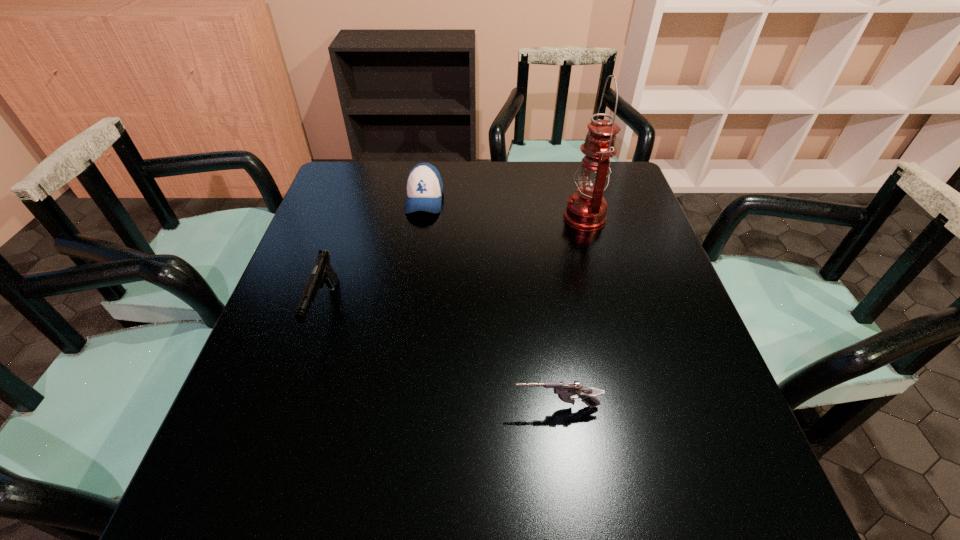
At what (x,y) coordinates should I click in order to perform the action: click on oil lamp. Please return your answer as a coordinate pair (x, y). This screenshot has width=960, height=540. Looking at the image, I should click on (586, 209).

Where is `the rightmost object`? The height and width of the screenshot is (540, 960). the rightmost object is located at coordinates (586, 209).

Find the location of a particular element. Image resolution: width=960 pixels, height=540 pixels. the second nearest object is located at coordinates (323, 272).

Where is `the farther gun`? This screenshot has width=960, height=540. the farther gun is located at coordinates (323, 272).

Locate an element on the screen. The height and width of the screenshot is (540, 960). the second shortest object is located at coordinates click(x=424, y=187).

The height and width of the screenshot is (540, 960). Identify the location of baseball cap. (424, 187).

In order to click on the shorter gun in this screenshot , I will do `click(565, 390)`.

Find the location of a particular element. This screenshot has width=960, height=540. the nearest object is located at coordinates (565, 390).

This screenshot has width=960, height=540. What are the coordinates of `free space located 0.220m on the left of the rightmost object` in the screenshot? It's located at (485, 218).

This screenshot has width=960, height=540. What are the coordinates of `vacant space situated 0.250m at the aiming end of the left gun` in the screenshot? It's located at (273, 467).